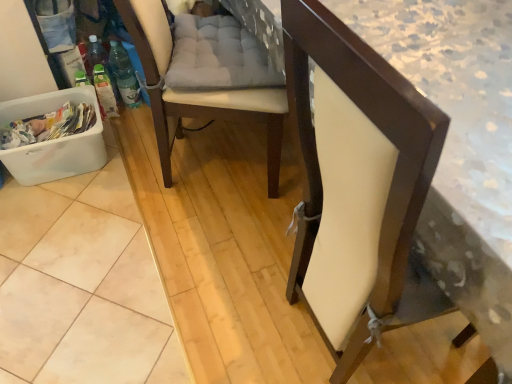
Question: Considering the relative sizes of white leather chair at center, which is the second chair from right to left, and matte white chair at center, the 2th chair in the left-to-right sequence, in the image provided, is white leather chair at center, which is the second chair from right to left, wider than matte white chair at center, the 2th chair in the left-to-right sequence,?

Choices:
 (A) no
 (B) yes

Answer: (B)

Question: From the image's perspective, is white leather chair at center, which is the first chair from left to right, over matte white chair at center, the 2th chair in the left-to-right sequence?

Choices:
 (A) yes
 (B) no

Answer: (A)

Question: Does white leather chair at center, which is the second chair from right to left, lie in front of matte white chair at center, which is the 1th chair in right-to-left order?

Choices:
 (A) no
 (B) yes

Answer: (A)

Question: Is white leather chair at center, which is the first chair from left to right, not within matte white chair at center, the 2th chair in the left-to-right sequence?

Choices:
 (A) no
 (B) yes

Answer: (B)

Question: Is white leather chair at center, which is the first chair from left to right, behind matte white chair at center, the 2th chair in the left-to-right sequence?

Choices:
 (A) no
 (B) yes

Answer: (B)

Question: Is matte white chair at center, which is the 1th chair in right-to-left order, situated inside white plastic laundry basket at lower left or outside?

Choices:
 (A) outside
 (B) inside

Answer: (A)

Question: From a real-world perspective, is matte white chair at center, which is the 1th chair in right-to-left order, above or below white plastic laundry basket at lower left?

Choices:
 (A) below
 (B) above

Answer: (B)

Question: Looking at their shapes, would you say matte white chair at center, the 2th chair in the left-to-right sequence, is wider or thinner than white plastic laundry basket at lower left?

Choices:
 (A) wide
 (B) thin

Answer: (A)

Question: Based on their sizes in the image, would you say matte white chair at center, which is the 1th chair in right-to-left order, is bigger or smaller than white plastic laundry basket at lower left?

Choices:
 (A) big
 (B) small

Answer: (A)

Question: From the image's perspective, relative to matte white chair at center, which is the 1th chair in right-to-left order, is white leather chair at center, which is the second chair from right to left, above or below?

Choices:
 (A) above
 (B) below

Answer: (A)

Question: Do you think white leather chair at center, which is the second chair from right to left, is within matte white chair at center, which is the 1th chair in right-to-left order, or outside of it?

Choices:
 (A) inside
 (B) outside

Answer: (B)

Question: Considering the positions of point (222, 18) and point (382, 76), is point (222, 18) closer or farther from the camera than point (382, 76)?

Choices:
 (A) farther
 (B) closer

Answer: (A)

Question: From a real-world perspective, is white leather chair at center, which is the first chair from left to right, above or below matte white chair at center, which is the 1th chair in right-to-left order?

Choices:
 (A) above
 (B) below

Answer: (B)

Question: Is white plastic laundry basket at lower left spatially inside white leather chair at center, which is the second chair from right to left, or outside of it?

Choices:
 (A) inside
 (B) outside

Answer: (B)

Question: Would you say white plastic laundry basket at lower left is to the left or to the right of white leather chair at center, which is the second chair from right to left, in the picture?

Choices:
 (A) left
 (B) right

Answer: (A)